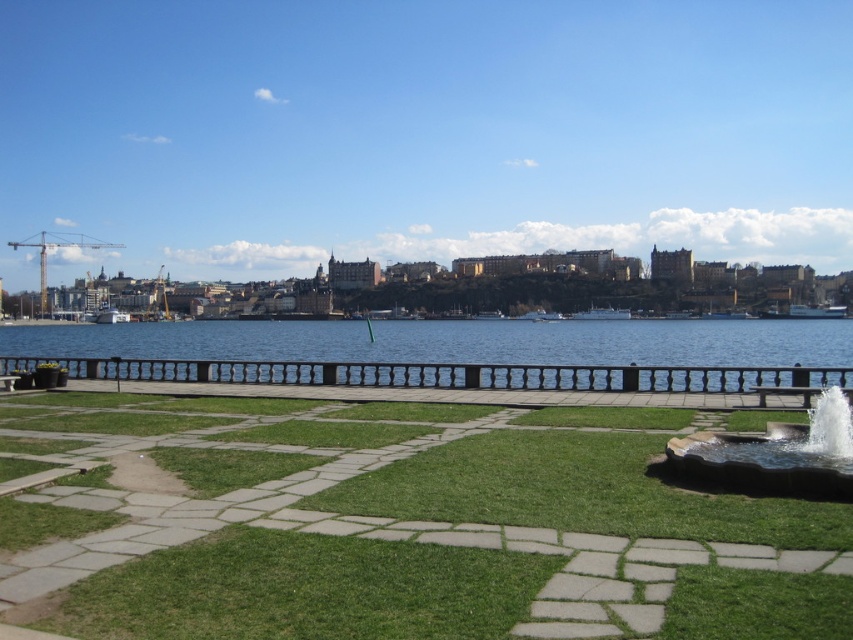
You are planning to place a small bench in the green grass at center. Considering the height of the grass, will the bench be easily visible to someone walking past the smooth stone fountain at lower right?

The green grass at center is much taller than the smooth stone fountain at lower right, so the bench placed there might be partially hidden from someone walking past the fountain.